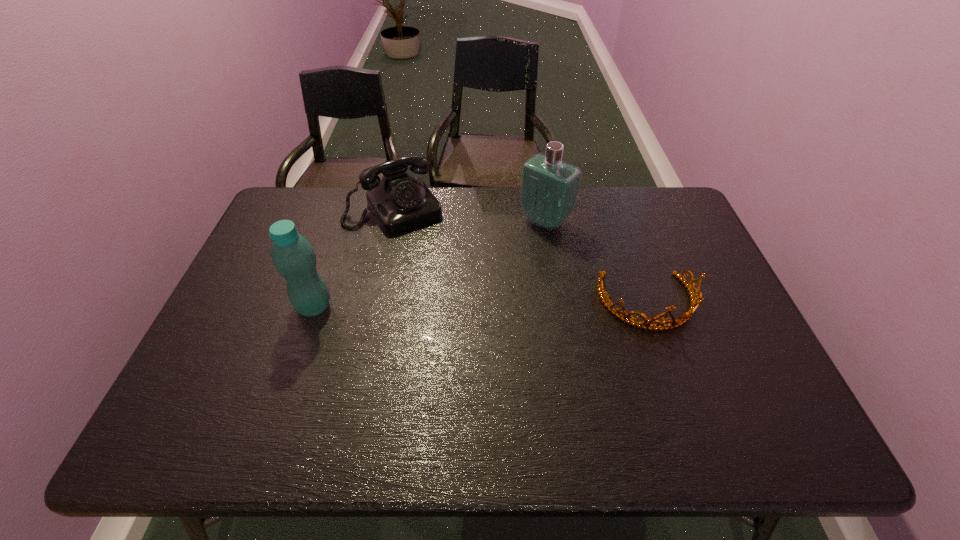
At what (x,y) coordinates should I click in order to perform the action: click on vacant spot on the desktop that is between the water bottle and the rightmost object and is positioned on the front label of the perfume. Please return your answer as a coordinate pair (x, y). Looking at the image, I should click on (452, 305).

Identify the location of vacant space on the desktop that is between the water bottle and the rightmost object and is positioned on the dial of the telephone. Image resolution: width=960 pixels, height=540 pixels. (458, 305).